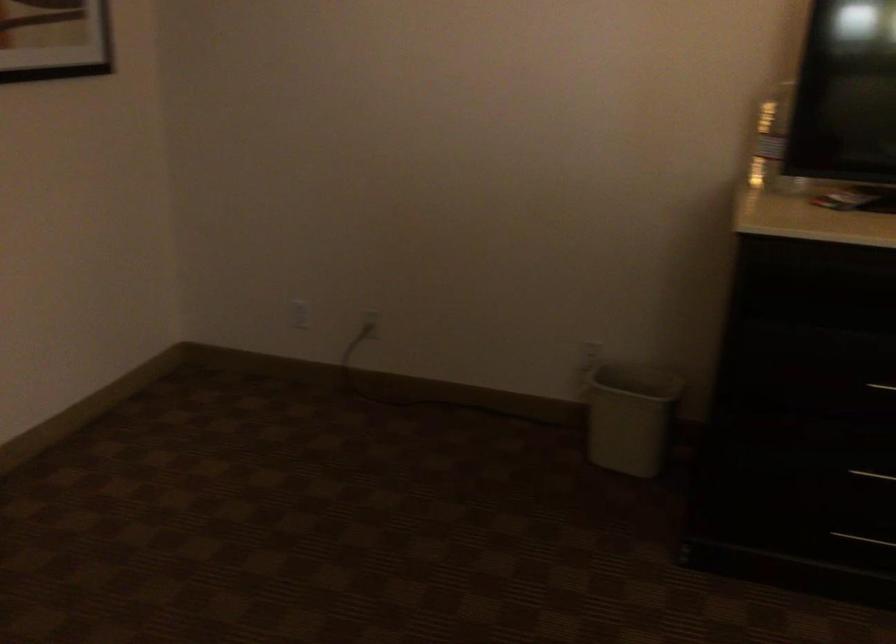
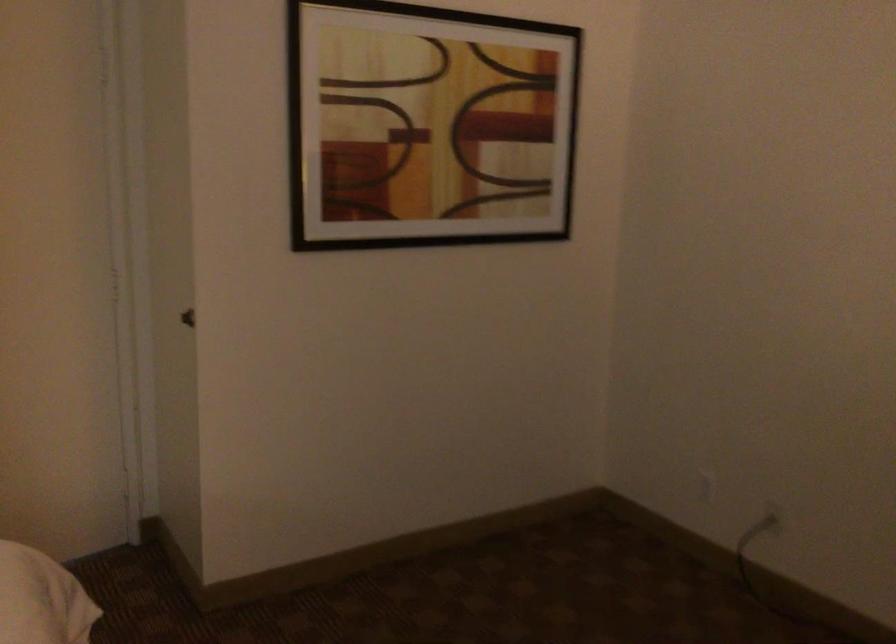
In the second image, find the point that corresponds to (316,314) in the first image.

(707, 487)